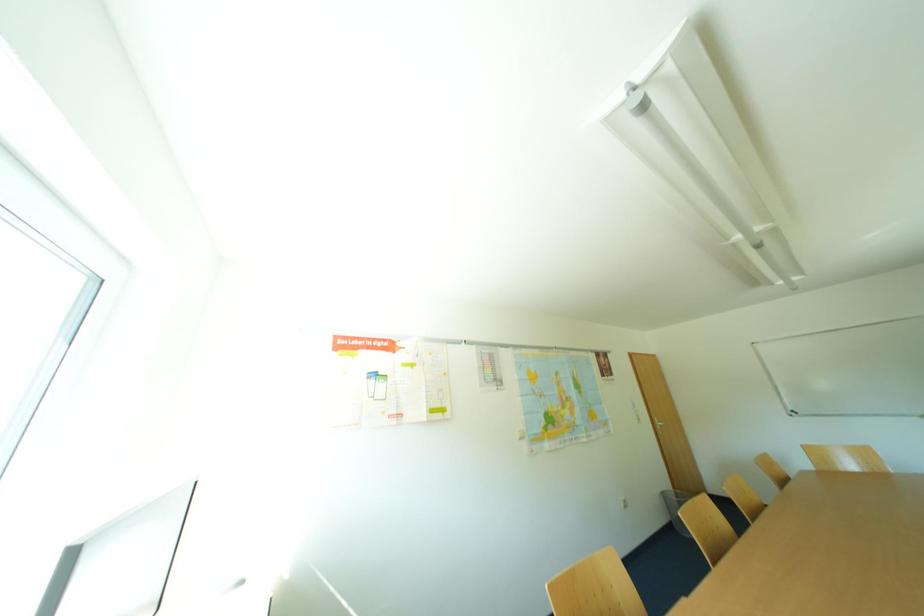
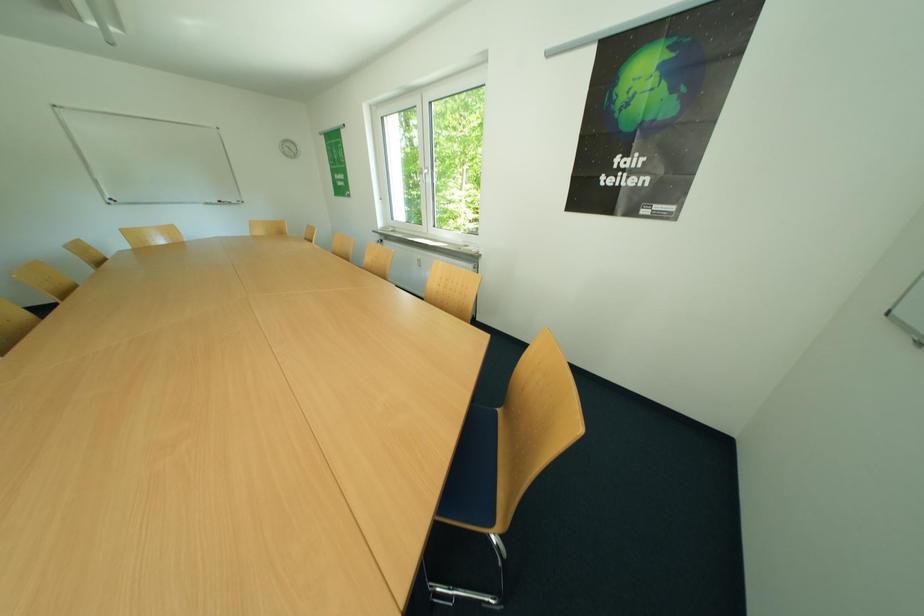
Question: The images are taken continuously from a first-person perspective. In which direction is your viewpoint rotating?

Choices:
 (A) Left
 (B) Right
 (C) Up
 (D) Down

Answer: (B)